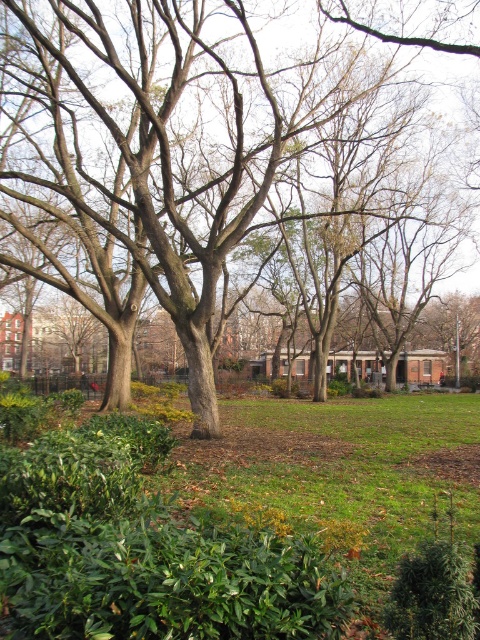
Question: Considering the relative positions of green leafy shrubs at lower left and brown rough tree at center in the image provided, where is green leafy shrubs at lower left located with respect to brown rough tree at center?

Choices:
 (A) left
 (B) right

Answer: (B)

Question: Among these objects, which one is nearest to the camera?

Choices:
 (A) green leafy shrubs at lower left
 (B) brown rough tree at center

Answer: (A)

Question: Among these points, which one is nearest to the camera?

Choices:
 (A) (25, 506)
 (B) (343, 108)

Answer: (A)

Question: Is green leafy shrubs at lower left in front of brown rough tree at center?

Choices:
 (A) yes
 (B) no

Answer: (A)

Question: Is green leafy shrubs at lower left in front of brown rough tree at center?

Choices:
 (A) yes
 (B) no

Answer: (A)